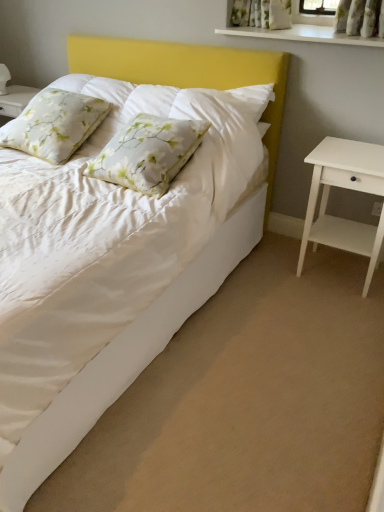
The width and height of the screenshot is (384, 512). I want to click on vacant position to the left of white matte nightstand at right, so click(275, 279).